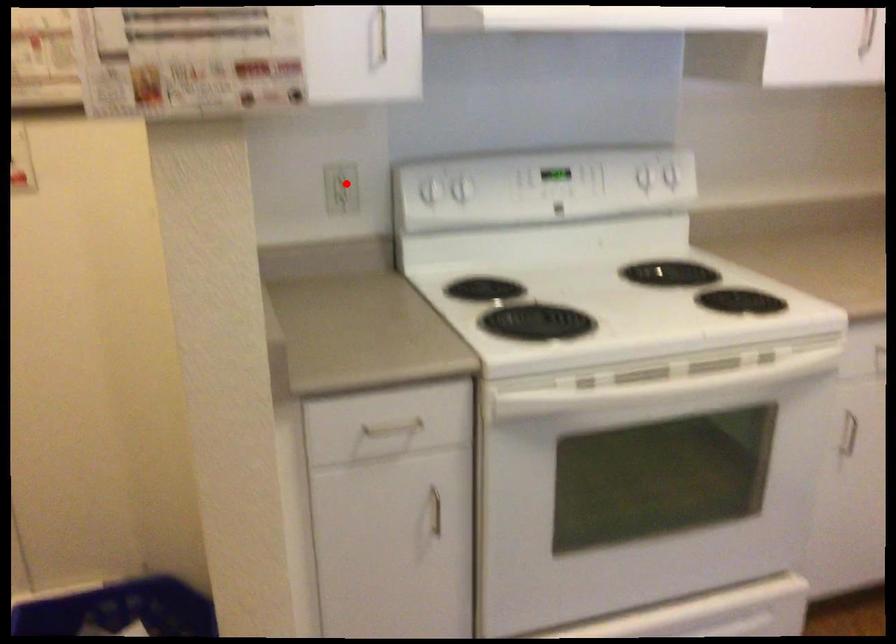
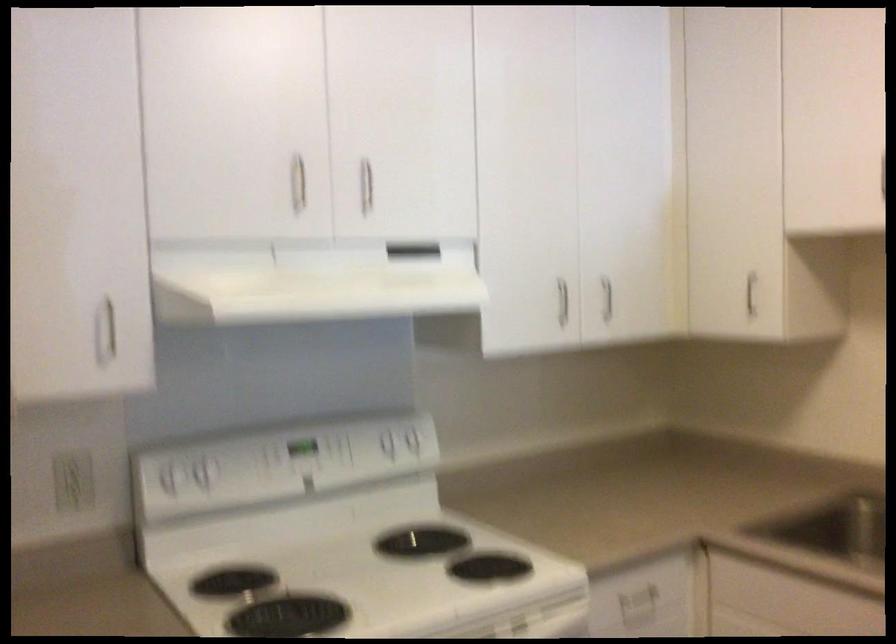
Find the pixel in the second image that matches the highlighted location in the first image.

(73, 480)